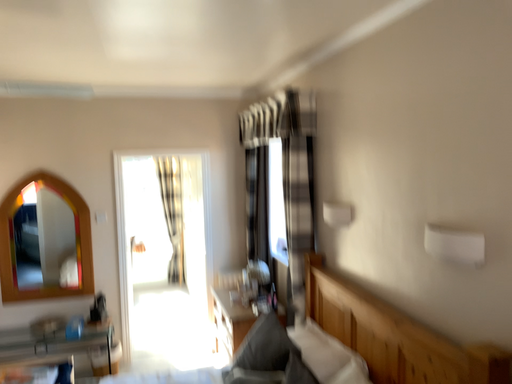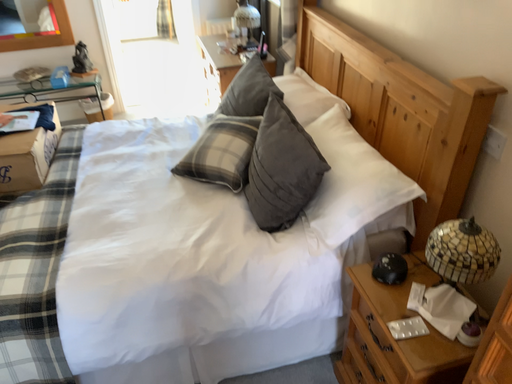
Question: How did the camera likely rotate when shooting the video?

Choices:
 (A) rotated downward
 (B) rotated upward

Answer: (A)